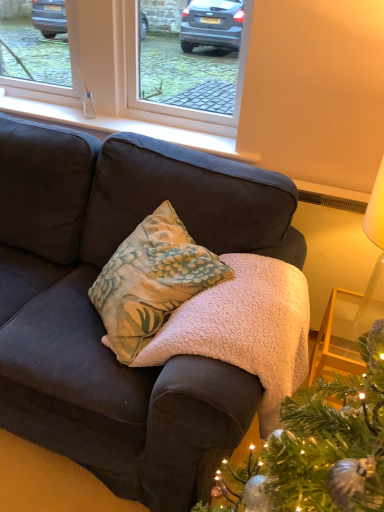
Question: Is the depth of white plastic window at upper center greater than that of white smooth window sill at upper center?

Choices:
 (A) yes
 (B) no

Answer: (B)

Question: Does white plastic window at upper center come in front of white smooth window sill at upper center?

Choices:
 (A) yes
 (B) no

Answer: (A)

Question: Considering the relative sizes of white plastic window at upper center and white smooth window sill at upper center in the image provided, is white plastic window at upper center smaller than white smooth window sill at upper center?

Choices:
 (A) no
 (B) yes

Answer: (A)

Question: Is white plastic window at upper center surrounding white smooth window sill at upper center?

Choices:
 (A) yes
 (B) no

Answer: (B)

Question: From the image's perspective, is white plastic window at upper center on white smooth window sill at upper center?

Choices:
 (A) no
 (B) yes

Answer: (B)

Question: Is white plastic window at upper center at the right side of white smooth window sill at upper center?

Choices:
 (A) no
 (B) yes

Answer: (A)

Question: Are white plastic window at upper center and white paper lampshade at upper right located far from each other?

Choices:
 (A) no
 (B) yes

Answer: (B)

Question: Is white plastic window at upper center placed right next to white paper lampshade at upper right?

Choices:
 (A) no
 (B) yes

Answer: (A)

Question: Can you confirm if white plastic window at upper center is bigger than white paper lampshade at upper right?

Choices:
 (A) no
 (B) yes

Answer: (B)

Question: Does white plastic window at upper center come behind white paper lampshade at upper right?

Choices:
 (A) yes
 (B) no

Answer: (A)

Question: From a real-world perspective, is white plastic window at upper center below white paper lampshade at upper right?

Choices:
 (A) yes
 (B) no

Answer: (B)

Question: Is white plastic window at upper center shorter than white paper lampshade at upper right?

Choices:
 (A) yes
 (B) no

Answer: (A)

Question: From a real-world perspective, does white smooth window sill at upper center stand above white plastic window at upper center?

Choices:
 (A) yes
 (B) no

Answer: (B)